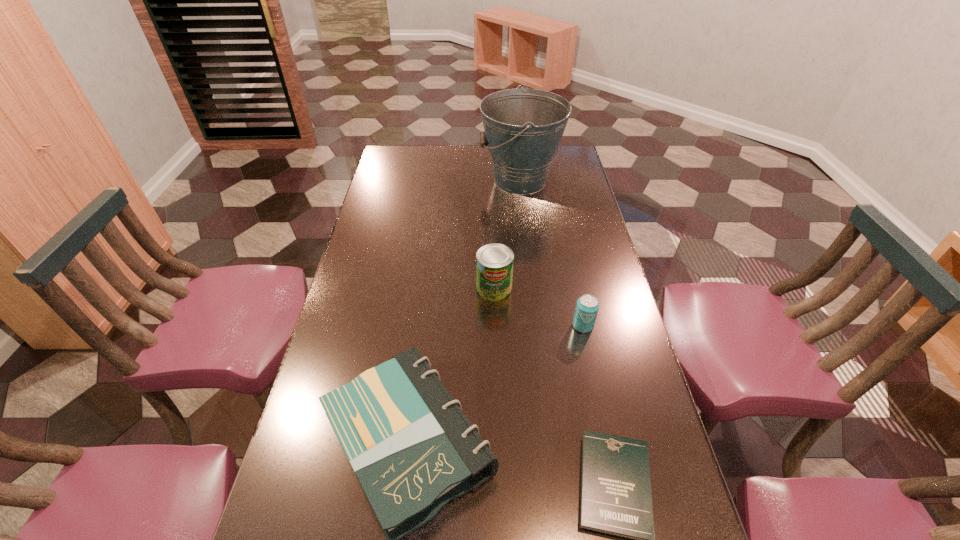
Identify the location of object positioned at the far edge. (523, 128).

The image size is (960, 540). I want to click on bucket present at the right edge, so click(x=523, y=128).

This screenshot has width=960, height=540. Identify the location of beer can at the right edge. (587, 306).

The image size is (960, 540). In order to click on object that is at the far right corner in this screenshot , I will do `click(523, 128)`.

In the image, there is a desktop. Identify the location of vacant space at the far edge. (472, 154).

Find the location of `vacant region at the left edge of the desktop`. vacant region at the left edge of the desktop is located at coordinates (358, 498).

Find the location of a particular element. Image resolution: width=960 pixels, height=540 pixels. vacant area at the right edge of the desktop is located at coordinates [552, 204].

I want to click on vacant point located between the can and the beer can, so click(539, 307).

This screenshot has width=960, height=540. Identify the location of empty space between the farthest object and the third nearest object. (551, 253).

Locate an element on the screen. free space that is in between the second farthest object and the third nearest object is located at coordinates (539, 307).